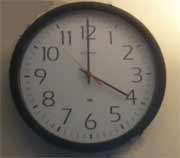
At what (x,y) coordinates should I click in order to perform the action: click on shadow left of clock. Please return your answer as a coordinate pair (x, y). Looking at the image, I should click on (30, 140).